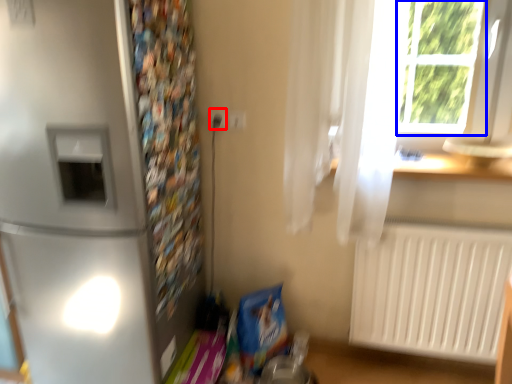
Question: Which of the following is the farthest to the observer, electric outlet (highlighted by a red box) or window frame (highlighted by a blue box)?

Choices:
 (A) electric outlet
 (B) window frame

Answer: (A)